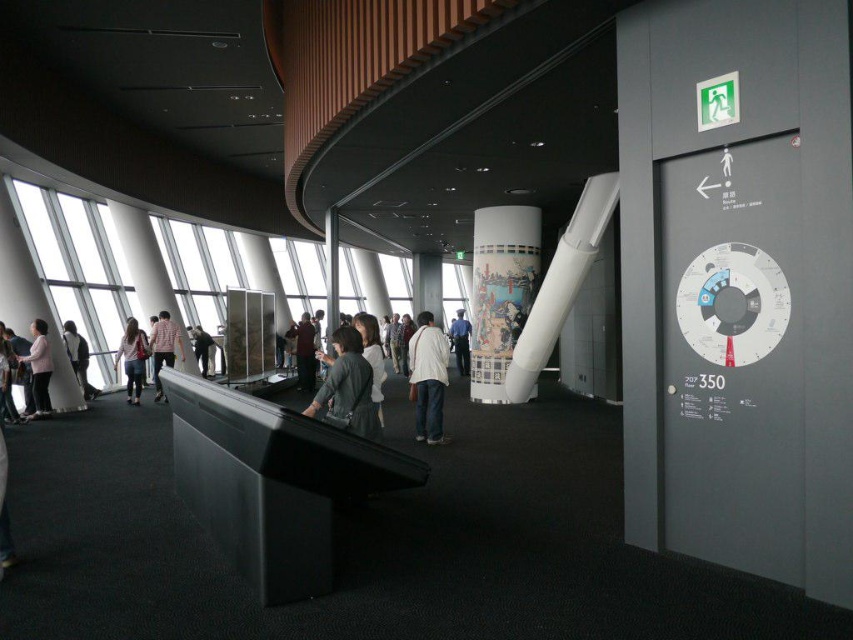
What is the color and location of the object at point coordinates (39,369)?

The object at point coordinates (39,369) is light pink fabric at left.

You are standing in the modern interior space and see both the white matte jacket at center and the plaid shirt at center. Which one is located to the right of the other?

The white matte jacket at center is positioned on the right side of plaid shirt at center.